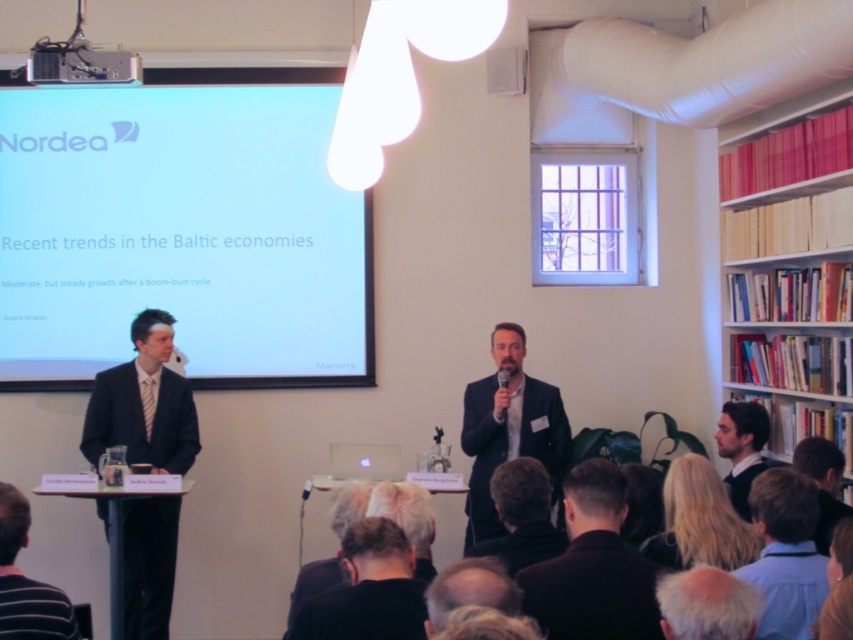
Does black fabric jacket at lower center have a greater width compared to blue shirt at lower right?

Indeed, black fabric jacket at lower center has a greater width compared to blue shirt at lower right.

Does point (624, 627) come in front of point (756, 572)?

Yes, point (624, 627) is in front of point (756, 572).

The height and width of the screenshot is (640, 853). I want to click on black fabric jacket at lower center, so click(x=593, y=566).

Who is taller, blue shirt at lower right or dark brown leather jacket at lower right?

With more height is blue shirt at lower right.

This screenshot has height=640, width=853. What do you see at coordinates (785, 554) in the screenshot?
I see `blue shirt at lower right` at bounding box center [785, 554].

Identify the location of blue shirt at lower right. (785, 554).

Looking at this image, who is taller, hardcover books at right or blonde hair at lower center?

hardcover books at right is taller.

Between hardcover books at right and blonde hair at lower center, which one is positioned lower?

blonde hair at lower center is lower down.

Find the location of a particular element. This screenshot has width=853, height=640. hardcover books at right is located at coordinates (791, 291).